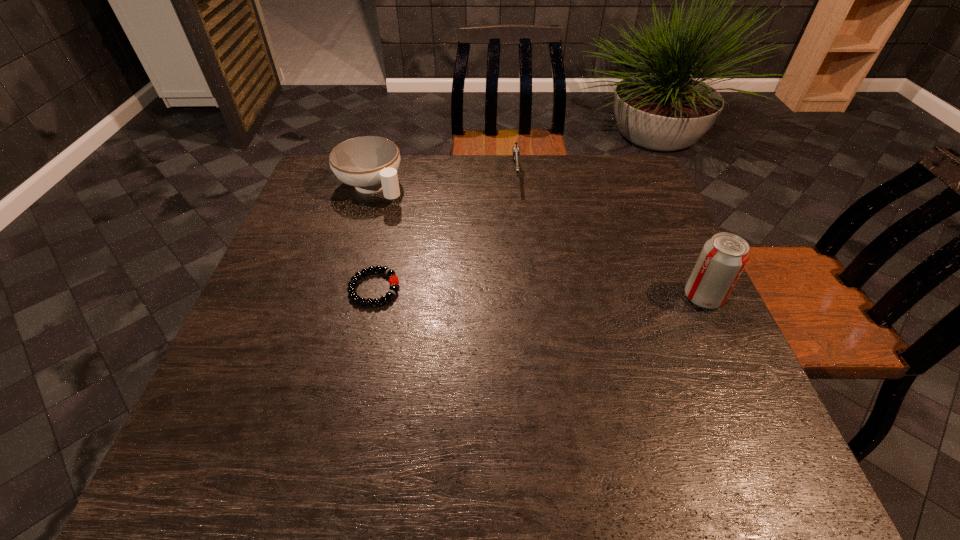
Locate an element on the screen. This screenshot has height=540, width=960. vacant space at the near edge of the desktop is located at coordinates (316, 415).

This screenshot has width=960, height=540. Find the location of `free space at the left edge`. free space at the left edge is located at coordinates (296, 308).

You are a GUI agent. You are given a task and a screenshot of the screen. Output one action in this format:
    pyautogui.click(x=<x>, y=<y>)
    Task: Click on the free space at the right edge of the desktop
    
    Given the screenshot: What is the action you would take?
    (618, 223)

Locate an element on the screen. Image resolution: width=960 pixels, height=540 pixels. vacant region at the far right corner of the desktop is located at coordinates (626, 158).

This screenshot has height=540, width=960. Find the location of `free point between the pistol and the second tallest object`. free point between the pistol and the second tallest object is located at coordinates (444, 180).

Identify the location of free space between the second tallest object and the shortest object. The height and width of the screenshot is (540, 960). (372, 238).

Where is `free space between the bracelet and the third object from left to right`? This screenshot has width=960, height=540. free space between the bracelet and the third object from left to right is located at coordinates (445, 231).

Where is `blank region between the second tallest object and the bracelet`? Image resolution: width=960 pixels, height=540 pixels. blank region between the second tallest object and the bracelet is located at coordinates (372, 238).

You are a GUI agent. You are given a task and a screenshot of the screen. Output one action in this format:
    pyautogui.click(x=<x>, y=<y>)
    Task: Click on the vacant area that lies between the bracelet and the second shortest object
    
    Given the screenshot: What is the action you would take?
    pyautogui.click(x=445, y=231)

Find the location of a particular element. Image resolution: width=960 pixels, height=540 pixels. free space between the bracelet and the third object from left to right is located at coordinates (445, 231).